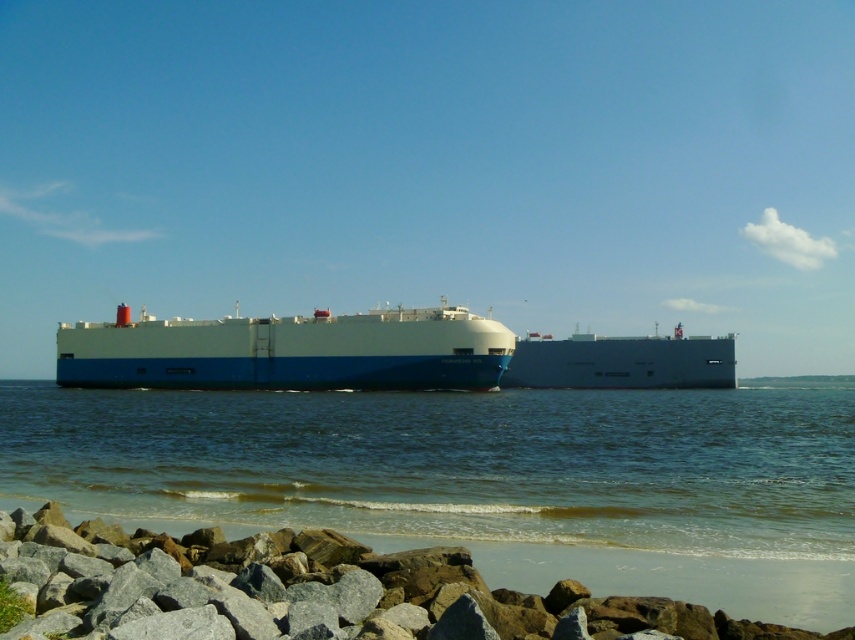
Measure the distance between blue matte cargo ship at center and white matte ship at center.

blue matte cargo ship at center and white matte ship at center are 98.25 feet apart.

The height and width of the screenshot is (640, 855). Describe the element at coordinates (287, 352) in the screenshot. I see `blue matte cargo ship at center` at that location.

Does point (304, 344) come farther from viewer compared to point (667, 364)?

No, (304, 344) is closer to viewer.

The height and width of the screenshot is (640, 855). Find the location of `blue matte cargo ship at center`. blue matte cargo ship at center is located at coordinates (287, 352).

Between point (629, 532) and point (606, 362), which one is positioned behind?

The point (606, 362) is more distant.

Is blue water at center to the left of white matte ship at center from the viewer's perspective?

Indeed, blue water at center is positioned on the left side of white matte ship at center.

I want to click on blue water at center, so click(x=482, y=480).

Can you confirm if blue water at center is thinner than blue matte cargo ship at center?

Incorrect, blue water at center's width is not less than blue matte cargo ship at center's.

Is blue water at center further to camera compared to blue matte cargo ship at center?

No, blue water at center is closer to the viewer.

Who is more distant from viewer, [794,433] or [458,355]?

The point [458,355] is behind.

Find the location of `blue water at center`. blue water at center is located at coordinates (482, 480).